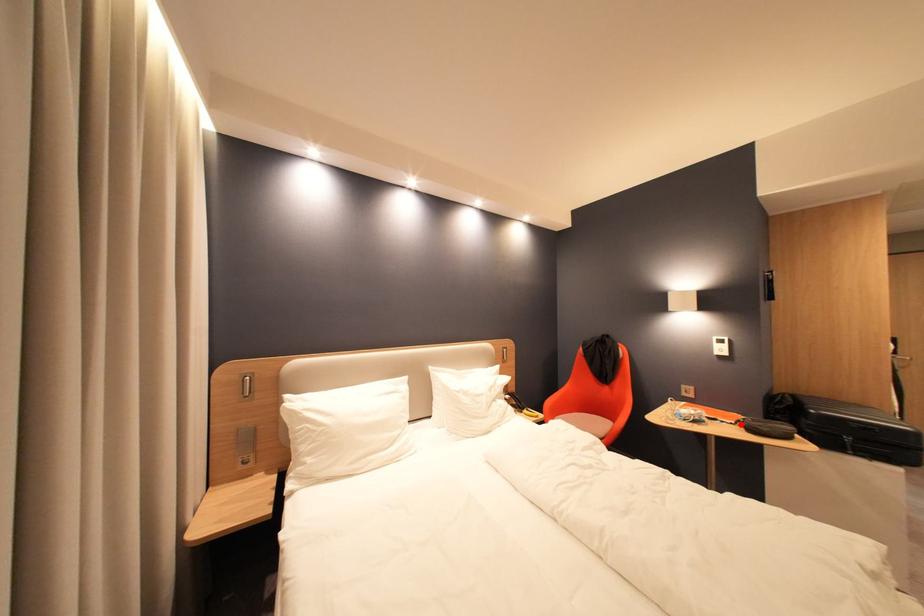
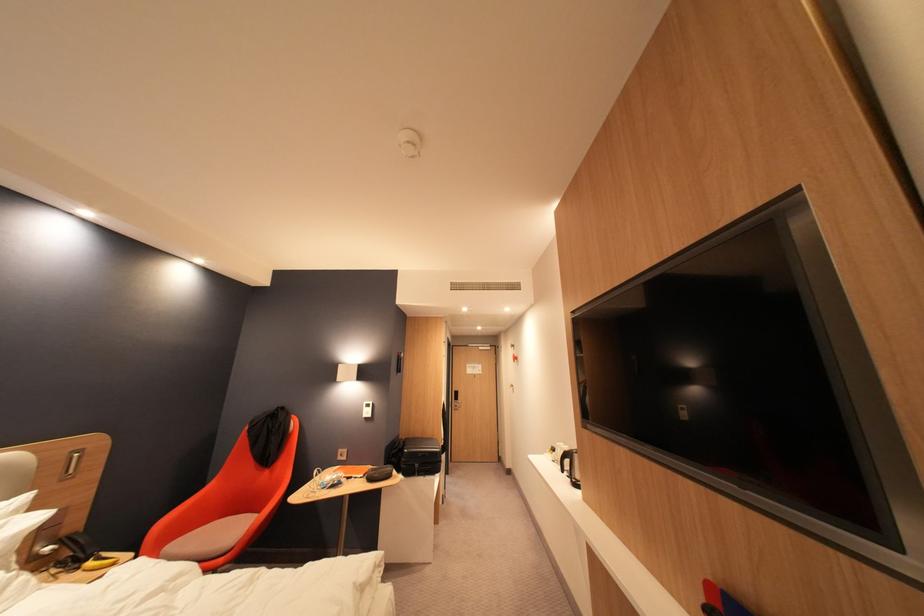
Question: A red point is marked in image1. In image2, is the corresponding 3D point closer to the camera or farther? Reply with the corresponding letter.

Choices:
 (A) The corresponding 3D point is closer.
 (B) The corresponding 3D point is farther.

Answer: (B)